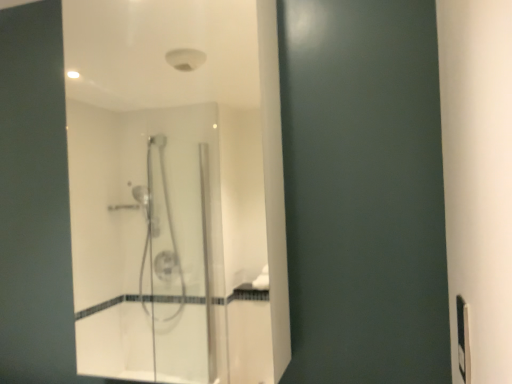
The image size is (512, 384). Find the location of `transparent glass shower door at center`. transparent glass shower door at center is located at coordinates pyautogui.click(x=147, y=243).

What do you see at coordinates (147, 243) in the screenshot? I see `transparent glass shower door at center` at bounding box center [147, 243].

Measure the distance between point [467,378] and camera.

Point [467,378] is 27.60 inches from camera.

Image resolution: width=512 pixels, height=384 pixels. What do you see at coordinates (463, 340) in the screenshot?
I see `black plastic electric outlet at right` at bounding box center [463, 340].

Locate an element on the screen. This screenshot has width=512, height=384. black plastic electric outlet at right is located at coordinates (463, 340).

Locate an element on the screen. transparent glass shower door at center is located at coordinates (147, 243).

Would you say black plastic electric outlet at right is to the left or to the right of transparent glass shower door at center in the picture?

In the image, black plastic electric outlet at right appears on the right side of transparent glass shower door at center.

In the image, is black plastic electric outlet at right positioned in front of or behind transparent glass shower door at center?

In the image, black plastic electric outlet at right appears in front of transparent glass shower door at center.

Considering the positions of points (465, 347) and (102, 131), is point (465, 347) closer to camera compared to point (102, 131)?

That is True.

From the image's perspective, which is below, black plastic electric outlet at right or transparent glass shower door at center?

From the image's view, black plastic electric outlet at right is below.

From a real-world perspective, is black plastic electric outlet at right positioned above or below transparent glass shower door at center?

black plastic electric outlet at right is below transparent glass shower door at center.

Which of these two, black plastic electric outlet at right or transparent glass shower door at center, is thinner?

black plastic electric outlet at right is thinner.

Can you confirm if black plastic electric outlet at right is shorter than transparent glass shower door at center?

Indeed, black plastic electric outlet at right has a lesser height compared to transparent glass shower door at center.

Can you confirm if black plastic electric outlet at right is smaller than transparent glass shower door at center?

Indeed, black plastic electric outlet at right has a smaller size compared to transparent glass shower door at center.

Do you think black plastic electric outlet at right is within transparent glass shower door at center, or outside of it?

black plastic electric outlet at right is outside transparent glass shower door at center.

Are black plastic electric outlet at right and transparent glass shower door at center located far from each other?

black plastic electric outlet at right is far away from transparent glass shower door at center.

Could you tell me if black plastic electric outlet at right is facing transparent glass shower door at center?

Yes, black plastic electric outlet at right is facing transparent glass shower door at center.

This screenshot has height=384, width=512. In order to click on electric outlet in front of the transparent glass shower door at center in this screenshot , I will do `click(463, 340)`.

Based on the photo, is transparent glass shower door at center to the left of black plastic electric outlet at right from the viewer's perspective?

Yes.

Is transparent glass shower door at center positioned behind black plastic electric outlet at right?

Yes.

Does point (188, 249) appear closer or farther from the camera than point (467, 340)?

Clearly, point (188, 249) is more distant from the camera than point (467, 340).

From the image's perspective, is transparent glass shower door at center above black plastic electric outlet at right?

Yes, from the image's perspective, transparent glass shower door at center is above black plastic electric outlet at right.

From a real-world perspective, is transparent glass shower door at center beneath black plastic electric outlet at right?

No.

In terms of width, does transparent glass shower door at center look wider or thinner when compared to black plastic electric outlet at right?

transparent glass shower door at center is wider than black plastic electric outlet at right.

Who is taller, transparent glass shower door at center or black plastic electric outlet at right?

transparent glass shower door at center is taller.

Is transparent glass shower door at center bigger or smaller than black plastic electric outlet at right?

In the image, transparent glass shower door at center appears to be larger than black plastic electric outlet at right.

Is black plastic electric outlet at right completely or partially inside transparent glass shower door at center?

No, black plastic electric outlet at right is not a part of transparent glass shower door at center.

Is transparent glass shower door at center far away from black plastic electric outlet at right?

That's right, there is a large distance between transparent glass shower door at center and black plastic electric outlet at right.

Does transparent glass shower door at center turn towards black plastic electric outlet at right?

No, transparent glass shower door at center does not turn towards black plastic electric outlet at right.

Can you tell me how much transparent glass shower door at center and black plastic electric outlet at right differ in facing direction?

The angle between the facing direction of transparent glass shower door at center and the facing direction of black plastic electric outlet at right is 94.2 degrees.

Find the location of a particular element. The height and width of the screenshot is (384, 512). screen door above the black plastic electric outlet at right (from the image's perspective) is located at coordinates (147, 243).

You are a GUI agent. You are given a task and a screenshot of the screen. Output one action in this format:
    pyautogui.click(x=<x>, y=<y>)
    Task: Click on the screen door on the left side of black plastic electric outlet at right
    
    Given the screenshot: What is the action you would take?
    pyautogui.click(x=147, y=243)

The image size is (512, 384). I want to click on electric outlet lying below the transparent glass shower door at center (from the image's perspective), so click(x=463, y=340).